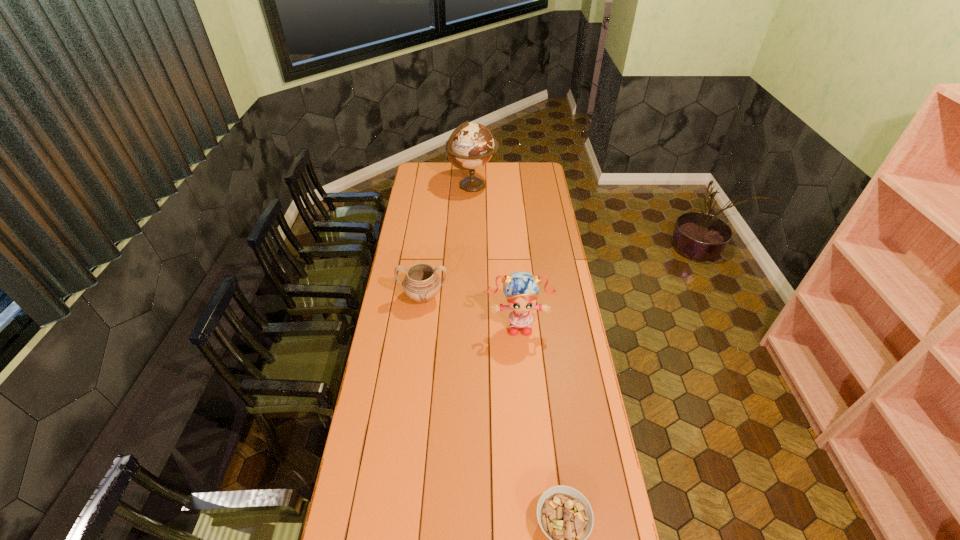
You are a GUI agent. You are given a task and a screenshot of the screen. Output one action in this format:
    pyautogui.click(x=<x>, y=<y>)
    Task: Click on the farthest object
    
    Given the screenshot: What is the action you would take?
    pyautogui.click(x=471, y=144)

Locate an element on the screen. globe is located at coordinates (471, 144).

Where is `doll`? This screenshot has height=540, width=960. doll is located at coordinates (521, 288).

Locate an element on the screen. Image resolution: width=960 pixels, height=540 pixels. urn is located at coordinates (421, 283).

The height and width of the screenshot is (540, 960). What are the coordinates of `vacant space located on the front of the tallest object showing Asia` in the screenshot? It's located at (509, 186).

I want to click on free space located 0.200m on the face of the third shortest object, so click(x=522, y=379).

Locate an element on the screen. This screenshot has height=540, width=960. free space located 0.380m on the front-facing side of the third tallest object is located at coordinates (413, 384).

This screenshot has width=960, height=540. Identify the location of object that is at the far edge. (471, 144).

Image resolution: width=960 pixels, height=540 pixels. I want to click on object that is at the left edge, so click(421, 283).

You are a GUI agent. You are given a task and a screenshot of the screen. Output one action in this format:
    pyautogui.click(x=<x>, y=<y>)
    Task: Click on the object at the right edge
    
    Given the screenshot: What is the action you would take?
    pyautogui.click(x=521, y=288)